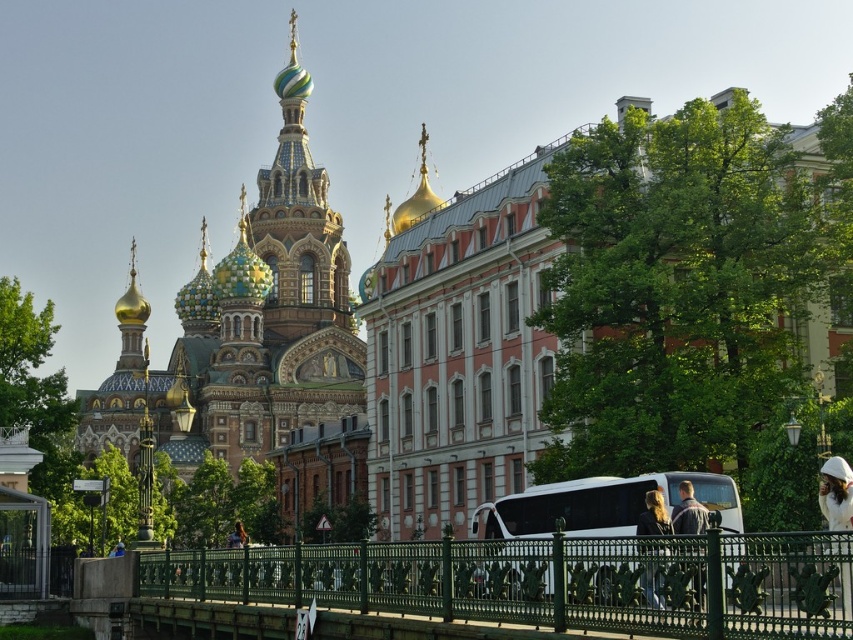
Question: Which is nearer to the multicolored mosaic dome at upper left?

Choices:
 (A) white glossy tour bus at center
 (B) blonde hair at lower center
 (C) light brown leather jacket at lower right
 (D) white matte helmet at upper right

Answer: (A)

Question: Which point is closer to the camera?

Choices:
 (A) (682, 490)
 (B) (846, 573)
 (C) (590, 518)
 (D) (167, 554)

Answer: (B)

Question: Is green wrought iron bridge at center thinner than white glossy tour bus at center?

Choices:
 (A) yes
 (B) no

Answer: (B)

Question: Which object is positioned closest to the multicolored mosaic dome at upper left?

Choices:
 (A) blonde hair at lower center
 (B) green wrought iron bridge at center
 (C) white matte helmet at upper right

Answer: (B)

Question: Does green wrought iron bridge at center have a lesser width compared to white matte helmet at upper right?

Choices:
 (A) yes
 (B) no

Answer: (B)

Question: From the image, what is the correct spatial relationship of multicolored mosaic dome at upper left in relation to green wrought iron bridge at center?

Choices:
 (A) left
 (B) right

Answer: (A)